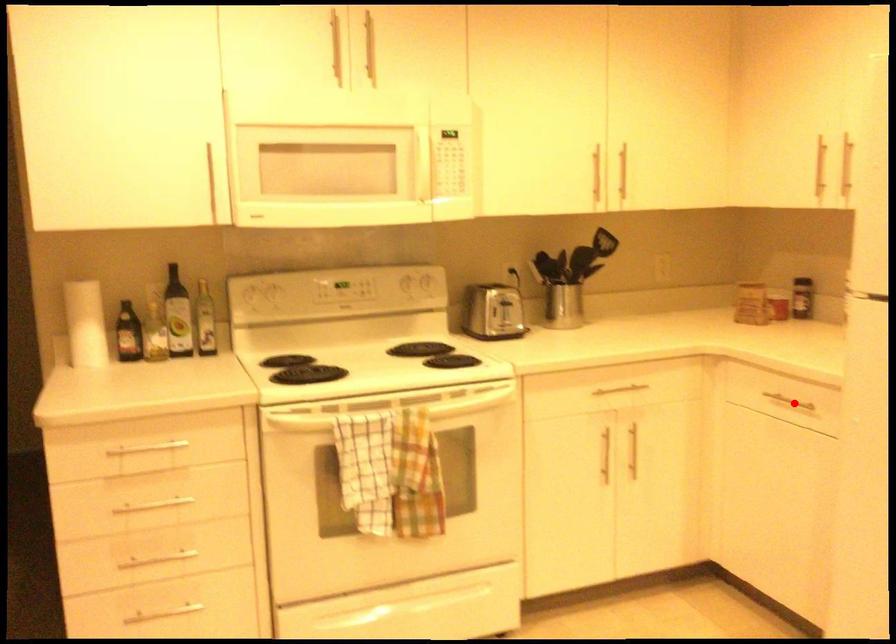
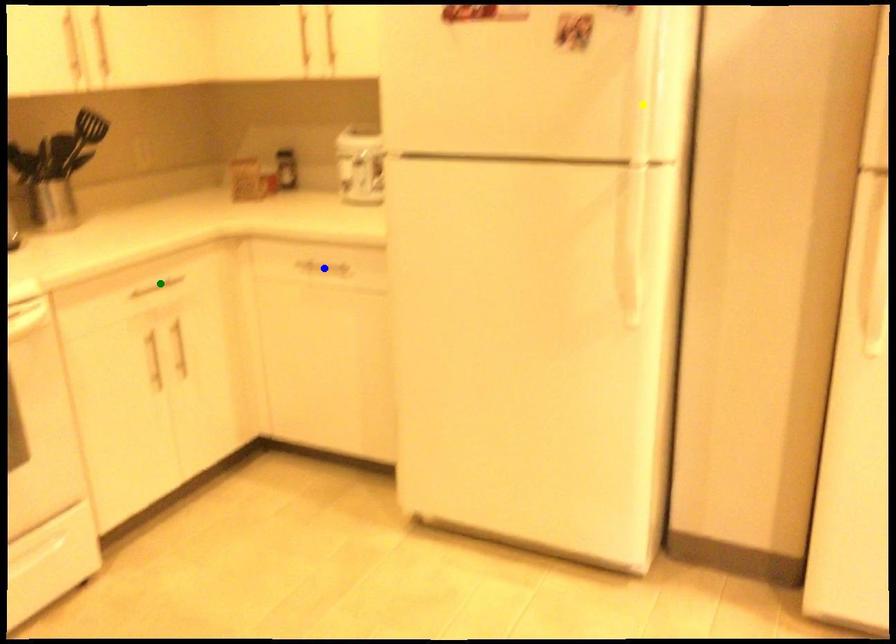
Question: I am providing you with two images of the same scene from different viewpoints. A red point is marked on the first image. You are given multiple points on the second image. Which mark in image 2 goes with the point in image 1?

Choices:
 (A) green point
 (B) blue point
 (C) yellow point

Answer: (B)